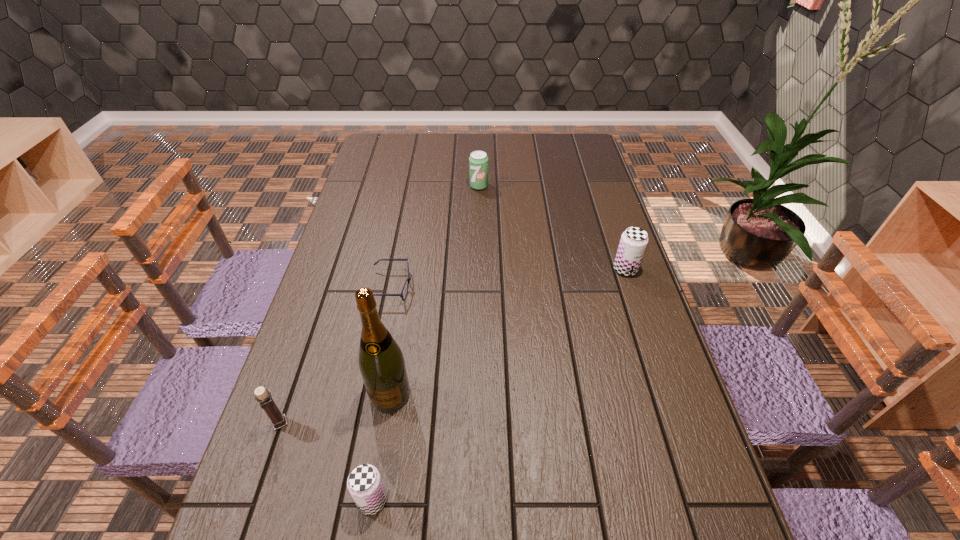
To achieve uniform spacing by inserting another beer_can among them, please point to a free space for this new beer_can. Please provide its 2D coordinates. Your answer should be formatted as a tuple, i.e. [(x, y)], where the tuple contains the x and y coordinates of a point satisfying the conditions above.

[(525, 360)]